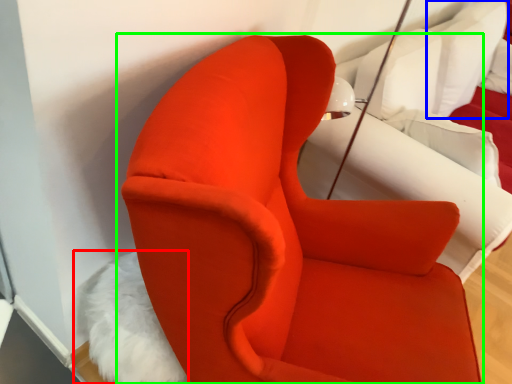
Question: Considering the real-world distances, which object is farthest from animal (highlighted by a red box)? pillow (highlighted by a blue box) or chair (highlighted by a green box)?

Choices:
 (A) pillow
 (B) chair

Answer: (A)